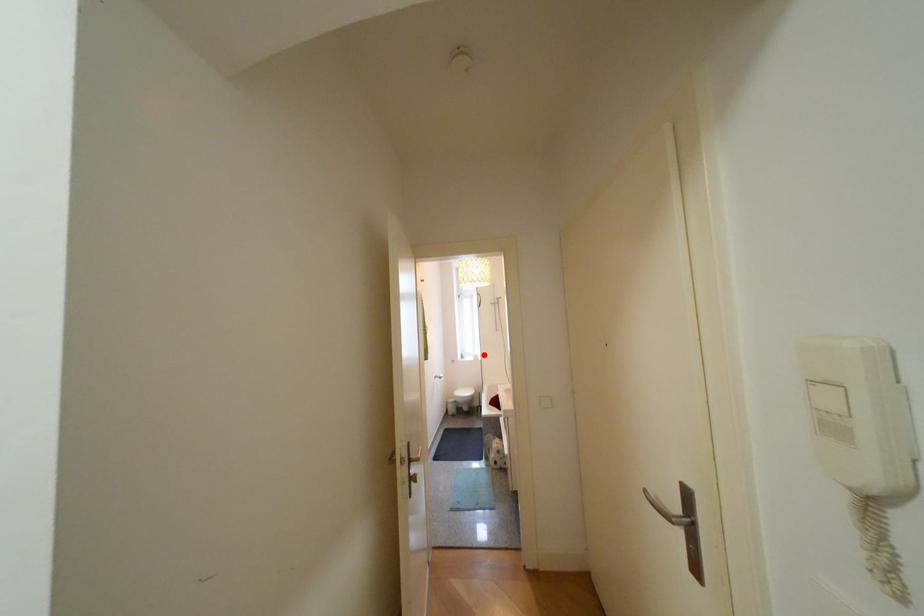
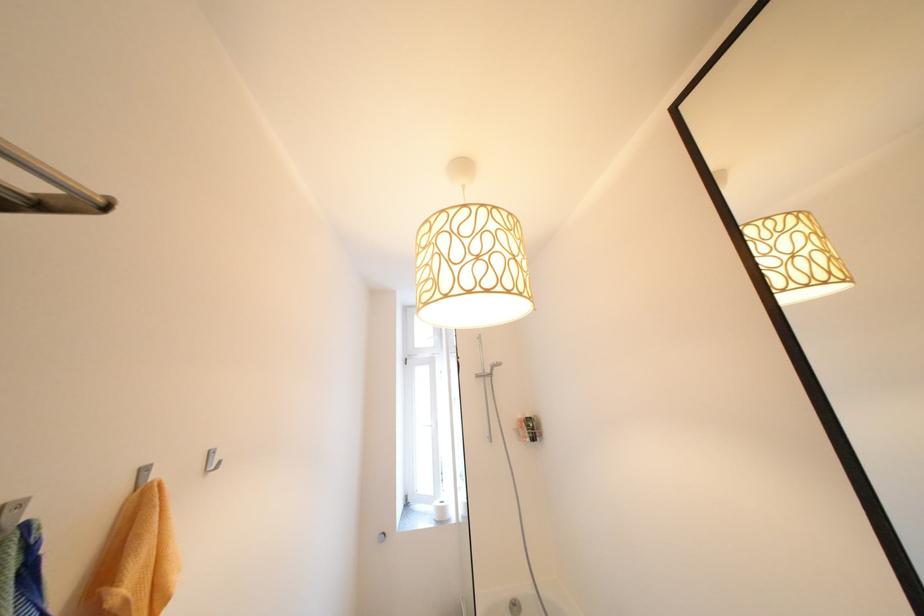
In the second image, find the point that corresponds to the highlighted location in the first image.

(447, 504)